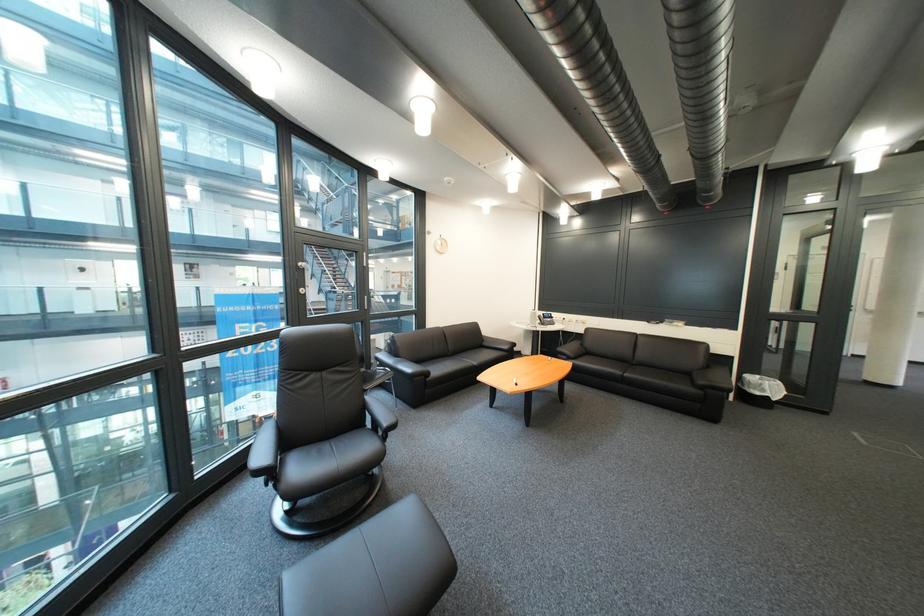
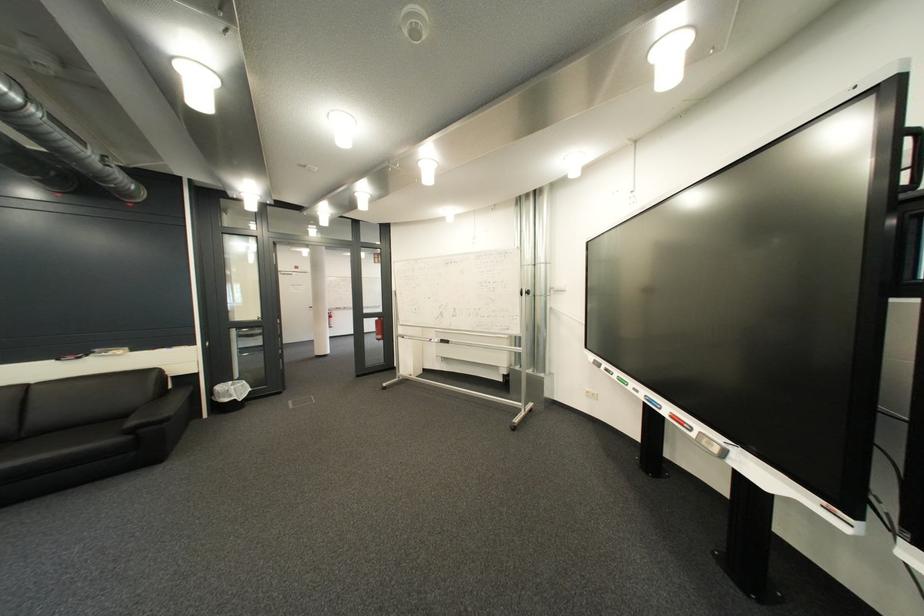
Where in the second image is the point corresponding to point (772, 378) from the first image?

(245, 384)